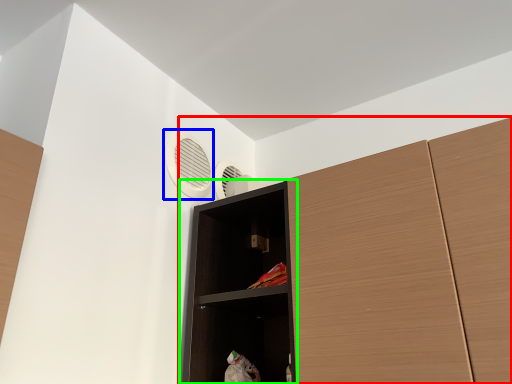
Question: Which is nearer to the cupboard (highlighted by a red box)? air conditioning (highlighted by a blue box) or shelf (highlighted by a green box).

Choices:
 (A) air conditioning
 (B) shelf

Answer: (B)